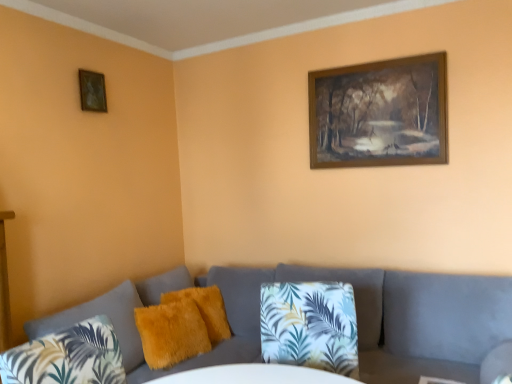
Question: Is fuzzy yellow pillow at center, which appears as the 2th pillow when viewed from the front, bigger or smaller than velvet grey couch at lower center?

Choices:
 (A) big
 (B) small

Answer: (B)

Question: Looking at their shapes, would you say fuzzy yellow pillow at center, which appears as the 2th pillow when viewed from the front, is wider or thinner than velvet grey couch at lower center?

Choices:
 (A) wide
 (B) thin

Answer: (B)

Question: Considering the real-world distances, which object is farthest from the wooden frame at upper right, the 1th picture frame from the right?

Choices:
 (A) velvet grey couch at lower center
 (B) blue-green leaf-patterned fabric pillow at center, the 3th pillow when ordered from back to front
 (C) fuzzy yellow pillow at center, arranged as the third pillow when viewed from the front
 (D) wooden picture frame at upper left, the first picture frame when ordered from left to right
 (E) fuzzy yellow pillow at center, which ranks as the 2th pillow in back-to-front order

Answer: (D)

Question: Estimate the real-world distances between objects in this image. Which object is farther from the velvet grey couch at lower center?

Choices:
 (A) blue-green leaf-patterned fabric pillow at center, positioned as the 1th pillow in front-to-back order
 (B) fuzzy yellow pillow at center, positioned as the 1th pillow in back-to-front order
 (C) fuzzy yellow pillow at center, which appears as the 2th pillow when viewed from the front
 (D) wooden picture frame at upper left, the first picture frame when ordered from left to right
 (E) wooden frame at upper right, acting as the 2th picture frame starting from the left

Answer: (D)